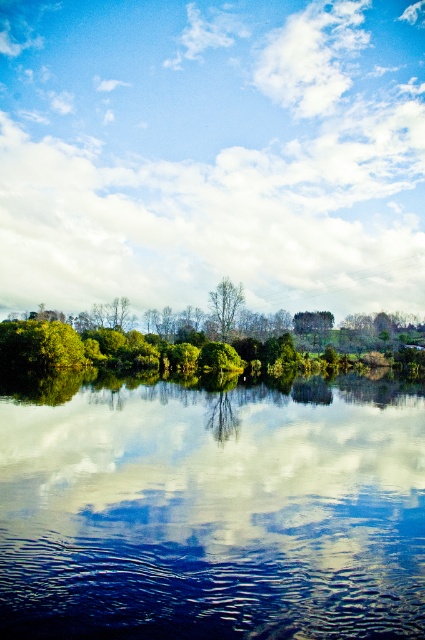
You are standing on the edge of the serene landscape and see both the transparent glass water at center and the smooth glass water at center. Which one is positioned more to the right side?

The transparent glass water at center is positioned more to the right side than the smooth glass water at center.

You are standing on the lakeshore and see the white fluffy cloud at upper center and the green matte tree at center. Which object is closer to you?

The green matte tree at center is behind the white fluffy cloud at upper center, so the white fluffy cloud at upper center is closer to you.

Looking at this image, you are standing at the edge of the water in the serene landscape scene. You see two points marked in the image. Which point is closer to you, point (172,360) or point (229,408)?

Point (172,360) is closer to you because it is further to the viewer than point (229,408).